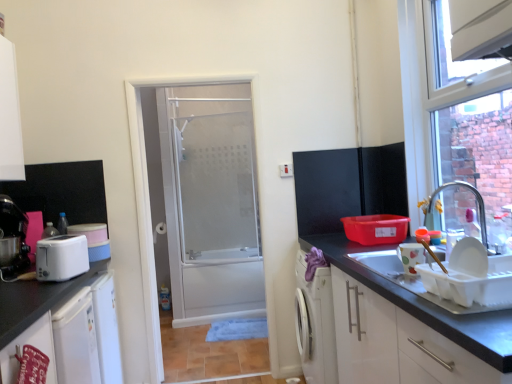
The width and height of the screenshot is (512, 384). What do you see at coordinates (12, 238) in the screenshot? I see `matte black coffee machine at left` at bounding box center [12, 238].

Identify the location of matte white cabinet at lower left, the 2th cabinetry viewed from the right. (32, 345).

At what (x,y) coordinates should I click in order to perform the action: click on white frosted glass door at center. Please return your answer as a coordinate pair (x, y). Looking at the image, I should click on (211, 202).

Is matte black coffee machine at left touching white plastic toaster at left, which is the first appliance from back to front?

No, matte black coffee machine at left is not in contact with white plastic toaster at left, which is the first appliance from back to front.

Considering the sizes of objects matte black coffee machine at left and white plastic toaster at left, which appears as the second appliance when viewed from the front, in the image provided, who is shorter, matte black coffee machine at left or white plastic toaster at left, which appears as the second appliance when viewed from the front,?

Standing shorter between the two is white plastic toaster at left, which appears as the second appliance when viewed from the front.

Is matte black coffee machine at left completely or partially outside of white plastic toaster at left, which is the first appliance from back to front?

matte black coffee machine at left lies outside white plastic toaster at left, which is the first appliance from back to front,'s area.

In the scene shown: Between matte black coffee machine at left and white plastic toaster at left, which ranks as the 1th appliance in left-to-right order, which one is positioned behind?

Positioned behind is matte black coffee machine at left.

Can you confirm if white matte refrigerator at lower left, the third cabinetry viewed from the right, is smaller than matte ceramic cup at right, which is counted as the second appliance, starting from the back?

No.

Does white matte refrigerator at lower left, the third cabinetry viewed from the right, turn towards matte ceramic cup at right, acting as the 1th appliance starting from the front?

Yes, white matte refrigerator at lower left, the third cabinetry viewed from the right, is turned towards matte ceramic cup at right, acting as the 1th appliance starting from the front.

Can you confirm if white matte refrigerator at lower left, the third cabinetry viewed from the right, is taller than matte ceramic cup at right, marked as the 2th appliance in a left-to-right arrangement?

Yes.

From the picture: Which object is closer to the camera taking this photo, white matte refrigerator at lower left, the third cabinetry viewed from the right, or matte ceramic cup at right, the 1th appliance in the right-to-left sequence?

Positioned in front is matte ceramic cup at right, the 1th appliance in the right-to-left sequence.

What are the coordinates of `cabinetry that appears on the right of frosted glass shower door at center` in the screenshot? It's located at (396, 343).

From the image's perspective, is frosted glass shower door at center below white glossy cabinet at lower right, marked as the first cabinetry in a right-to-left arrangement?

No, from the image's perspective, frosted glass shower door at center is not below white glossy cabinet at lower right, marked as the first cabinetry in a right-to-left arrangement.

Does frosted glass shower door at center have a larger size compared to white glossy cabinet at lower right, which is counted as the 3th cabinetry, starting from the left?

Incorrect, frosted glass shower door at center is not larger than white glossy cabinet at lower right, which is counted as the 3th cabinetry, starting from the left.

Consider the image. Does clear glass faucet at upper right have a larger size compared to white matte refrigerator at lower left, the third cabinetry viewed from the right?

No, clear glass faucet at upper right is not bigger than white matte refrigerator at lower left, the third cabinetry viewed from the right.

Does clear glass faucet at upper right have a greater height compared to white matte refrigerator at lower left, placed as the 1th cabinetry when sorted from left to right?

No, clear glass faucet at upper right is not taller than white matte refrigerator at lower left, placed as the 1th cabinetry when sorted from left to right.

Is clear glass faucet at upper right behind white matte refrigerator at lower left, placed as the 1th cabinetry when sorted from left to right?

Yes, the depth of clear glass faucet at upper right is greater than that of white matte refrigerator at lower left, placed as the 1th cabinetry when sorted from left to right.

Can you see frosted glass shower door at center touching white matte refrigerator at lower left, placed as the 1th cabinetry when sorted from left to right?

No, frosted glass shower door at center is not with white matte refrigerator at lower left, placed as the 1th cabinetry when sorted from left to right.

Which of these two, frosted glass shower door at center or white matte refrigerator at lower left, the third cabinetry viewed from the right, stands shorter?

With less height is white matte refrigerator at lower left, the third cabinetry viewed from the right.

From the image's perspective, which object appears higher, frosted glass shower door at center or white matte refrigerator at lower left, the third cabinetry viewed from the right?

frosted glass shower door at center is shown above in the image.

From a real-world perspective, which object rests below the other?

white matte refrigerator at lower left, the third cabinetry viewed from the right.

Considering the points (227, 195) and (197, 194), which point is behind, point (227, 195) or point (197, 194)?

Point (197, 194)

Which object is closer to the camera, white frosted glass door at center or frosted glass shower door at center?

white frosted glass door at center is more forward.

Is frosted glass shower door at center completely or partially inside white frosted glass door at center?

No, frosted glass shower door at center is not surrounded by white frosted glass door at center.

In the image, is white glossy cabinet at lower right, marked as the first cabinetry in a right-to-left arrangement, positioned in front of or behind frosted glass shower door at center?

Clearly, white glossy cabinet at lower right, marked as the first cabinetry in a right-to-left arrangement, is in front of frosted glass shower door at center.

From the image's perspective, is white glossy cabinet at lower right, marked as the first cabinetry in a right-to-left arrangement, on frosted glass shower door at center?

No, from the image's perspective, white glossy cabinet at lower right, marked as the first cabinetry in a right-to-left arrangement, is not over frosted glass shower door at center.

In terms of height, does white glossy cabinet at lower right, marked as the first cabinetry in a right-to-left arrangement, look taller or shorter compared to frosted glass shower door at center?

Considering their sizes, white glossy cabinet at lower right, marked as the first cabinetry in a right-to-left arrangement, has less height than frosted glass shower door at center.

Can you confirm if white glossy cabinet at lower right, marked as the first cabinetry in a right-to-left arrangement, is wider than frosted glass shower door at center?

Yes.

There is a white plastic toaster at left, which is the first appliance from back to front. At what (x,y) coordinates should I click in order to perform the action: click on coffee machine above it (from a real-world perspective). Please return your answer as a coordinate pair (x, y). Looking at the image, I should click on (12, 238).

Where is `the 3rd cabinetry below when counting from the matte ceramic cup at right, which is counted as the second appliance, starting from the back (from the image's perspective)`? the 3rd cabinetry below when counting from the matte ceramic cup at right, which is counted as the second appliance, starting from the back (from the image's perspective) is located at coordinates (74, 336).

Which object lies nearer to the anchor point white glossy cabinet at lower right, which is counted as the 3th cabinetry, starting from the left, frosted glass shower door at center or matte white cabinet at lower left, which ranks as the second cabinetry in left-to-right order?

matte white cabinet at lower left, which ranks as the second cabinetry in left-to-right order.

From the image, which object appears to be farther from matte ceramic cup at right, which is counted as the second appliance, starting from the back, matte black cabinet at upper right or white matte refrigerator at lower left, the third cabinetry viewed from the right?

Among the two, white matte refrigerator at lower left, the third cabinetry viewed from the right, is located further to matte ceramic cup at right, which is counted as the second appliance, starting from the back.

Looking at the image, which one is located further to matte black cabinet at upper right, clear glass faucet at upper right or white frosted glass door at center?

white frosted glass door at center.

Looking at the image, which one is located closer to white frosted glass door at center, matte black coffee machine at left or white glossy cabinet at lower right, which is counted as the 3th cabinetry, starting from the left?

The object closer to white frosted glass door at center is matte black coffee machine at left.

Looking at the image, which one is located closer to matte ceramic cup at right, acting as the 1th appliance starting from the front, clear glass faucet at upper right or white matte refrigerator at lower left, placed as the 1th cabinetry when sorted from left to right?

clear glass faucet at upper right lies closer to matte ceramic cup at right, acting as the 1th appliance starting from the front, than the other object.

When comparing their distances from white glossy cabinet at lower right, marked as the first cabinetry in a right-to-left arrangement, does white frosted glass door at center or matte ceramic cup at right, the 1th appliance in the right-to-left sequence, seem closer?

matte ceramic cup at right, the 1th appliance in the right-to-left sequence, is positioned closer to the anchor white glossy cabinet at lower right, marked as the first cabinetry in a right-to-left arrangement.

Based on their spatial positions, is white frosted glass door at center or clear glass faucet at upper right closer to frosted glass shower door at center?

white frosted glass door at center lies closer to frosted glass shower door at center than the other object.

Consider the image. Based on their spatial positions, is matte ceramic cup at right, marked as the 2th appliance in a left-to-right arrangement, or clear glass faucet at upper right closer to white frosted glass door at center?

clear glass faucet at upper right lies closer to white frosted glass door at center than the other object.

I want to click on tap between matte white cabinet at lower left, which ranks as the second cabinetry in left-to-right order, and frosted glass shower door at center from front to back, so click(x=477, y=202).

Image resolution: width=512 pixels, height=384 pixels. Identify the location of cabinetry positioned between matte white cabinet at lower left, which ranks as the second cabinetry in left-to-right order, and frosted glass shower door at center from near to far. (74, 336).

Where is `wide between matte black coffee machine at left and clear glass faucet at upper right in the horizontal direction`? The image size is (512, 384). wide between matte black coffee machine at left and clear glass faucet at upper right in the horizontal direction is located at coordinates pyautogui.click(x=348, y=185).

The image size is (512, 384). Find the location of `screen door between matte black coffee machine at left and matte black cabinet at upper right in the horizontal direction`. screen door between matte black coffee machine at left and matte black cabinet at upper right in the horizontal direction is located at coordinates (216, 186).